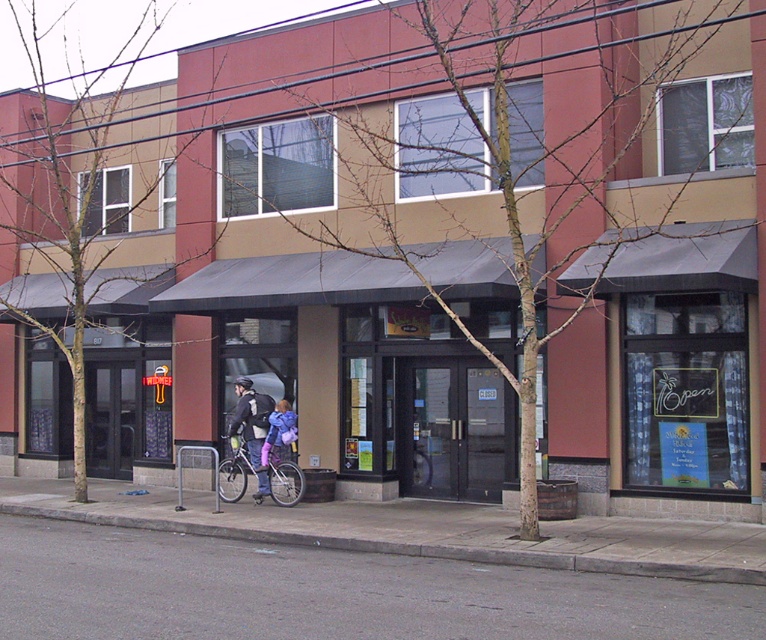
Does gray asphalt pavement at lower center have a lesser width compared to purple fabric bag at center?

No, gray asphalt pavement at lower center is not thinner than purple fabric bag at center.

Looking at this image, can you confirm if gray asphalt pavement at lower center is positioned below purple fabric bag at center?

Indeed, gray asphalt pavement at lower center is positioned under purple fabric bag at center.

Who is more forward, (352,632) or (273,497)?

Point (352,632) is in front.

This screenshot has width=766, height=640. Find the location of `gray asphalt pavement at lower center`. gray asphalt pavement at lower center is located at coordinates (326, 593).

Does silver metallic bicycle at center have a greater width compared to purple fabric bag at center?

Yes, silver metallic bicycle at center is wider than purple fabric bag at center.

Is silver metallic bicycle at center above purple fabric bag at center?

Actually, silver metallic bicycle at center is below purple fabric bag at center.

Does point (246, 465) lie in front of point (260, 461)?

No.

Where is `silver metallic bicycle at center`? This screenshot has height=640, width=766. silver metallic bicycle at center is located at coordinates (234, 470).

From the picture: Does gray concrete pavement at lower center come in front of purple fabric bag at center?

Yes, gray concrete pavement at lower center is closer to the viewer.

Is point (653, 563) positioned after point (262, 467)?

No.

Is point (598, 536) farther from viewer compared to point (287, 422)?

No, it is in front of (287, 422).

At what (x,y) coordinates should I click in order to perform the action: click on gray concrete pavement at lower center. Please return your answer as a coordinate pair (x, y). Image resolution: width=766 pixels, height=640 pixels. Looking at the image, I should click on tap(418, 531).